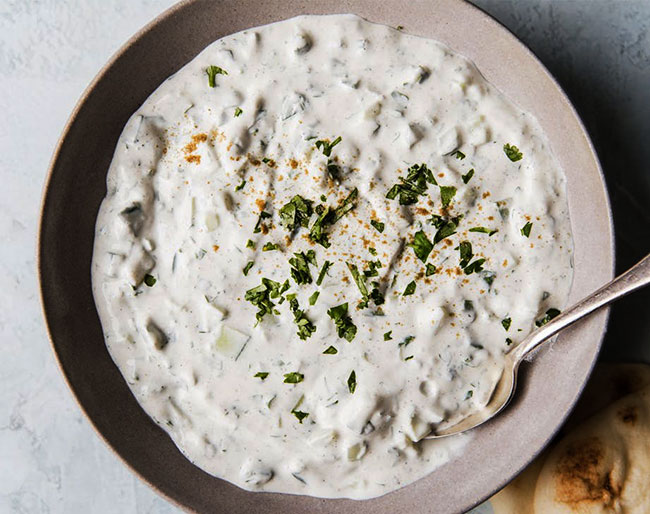
Find the location of `tan bowl in light`. tan bowl in light is located at coordinates (590, 254).